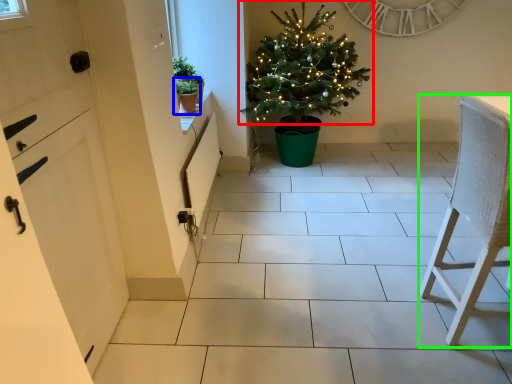
Question: Based on their relative distances, which object is farther from christmas tree (highlighted by a red box)? Choose from houseplant (highlighted by a blue box) and furniture (highlighted by a green box).

Choices:
 (A) houseplant
 (B) furniture

Answer: (B)